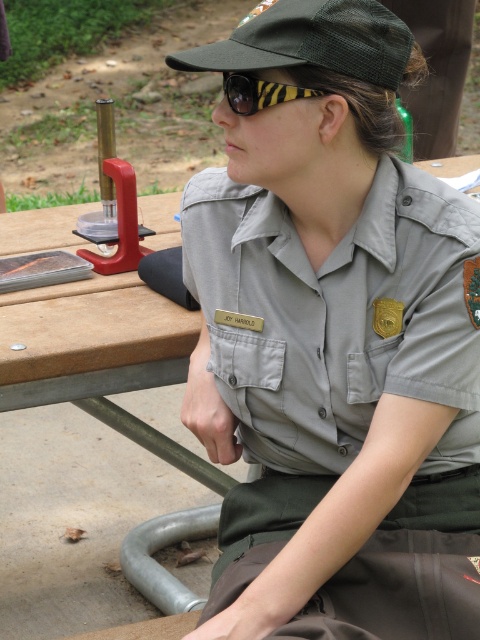
You are standing in front of the picnic table and want to reach both the gray fabric uniform at center and the black striped goggles at upper center. Which object is closer to you?

The gray fabric uniform at center is closer to you because it is further to the viewer than the black striped goggles at upper center.

You are an equipment inspector checking the gray fabric uniform at center and the black striped goggles at upper center. Which item do you need to check first if the uniform requires more attention due to its size compared to the goggles?

The gray fabric uniform at center needs to be checked first because it is larger in size than the black striped goggles at upper center, requiring more attention due to its size.